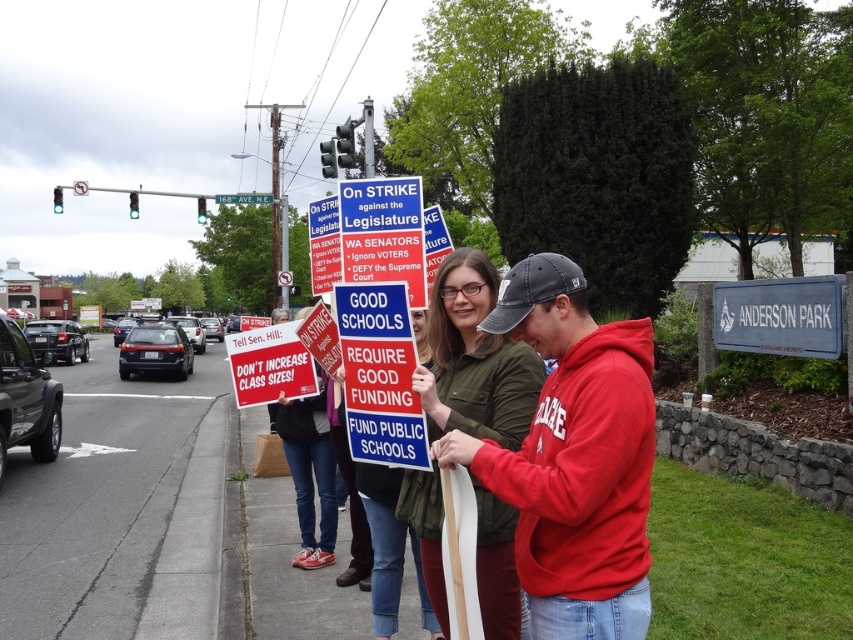
You are a photographer trying to capture a clear photo of the blue plastic sign at center and the metallic blue street sign at upper center. Which object should you focus on first if you want to ensure both are in focus without moving the camera?

The metallic blue street sign at upper center should be focused on first because it is larger than the blue plastic sign at center, making it easier to achieve focus on the larger object before adjusting for the smaller one.

You are a photographer trying to capture the protest scene. You want to ensure both the point at point (575, 636) and the point at point (419, 465) are clearly visible in your photo. Which point should you focus on first to ensure depth of field captures both?

You should focus on the point at point (419, 465) first because it is farther away than point (575, 636). By focusing on the farther point, the depth of field will include the closer point as well.

Based on the coordinates provided, what color is the sign located at point (379, 374)?

The sign at point (379, 374) is blue.